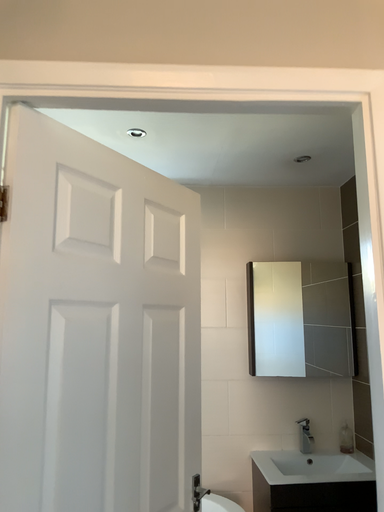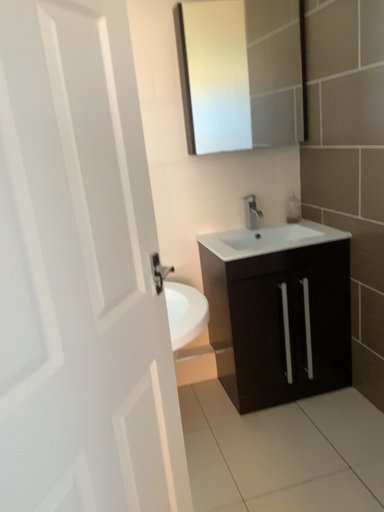
Question: Which way did the camera rotate in the video?

Choices:
 (A) rotated upward
 (B) rotated downward

Answer: (B)